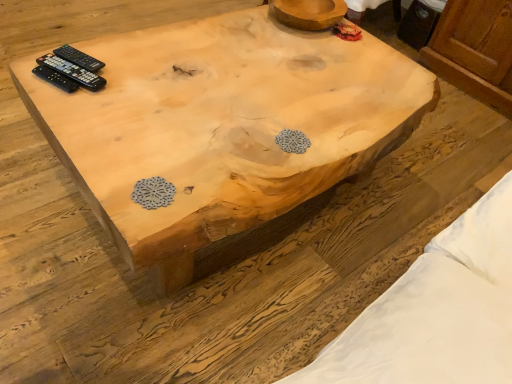
Question: Is black plastic remote at upper left, arranged as the first remote control when viewed from the front, facing away from black plastic remote control at upper left, the first remote control positioned from the back?

Choices:
 (A) yes
 (B) no

Answer: (B)

Question: From a real-world perspective, is black plastic remote at upper left, the 3th remote control when ordered from back to front, positioned over black plastic remote control at upper left, the first remote control positioned from the back, based on gravity?

Choices:
 (A) no
 (B) yes

Answer: (B)

Question: From a real-world perspective, is black plastic remote at upper left, the 3th remote control when ordered from back to front, below black plastic remote control at upper left, the first remote control positioned from the back?

Choices:
 (A) no
 (B) yes

Answer: (A)

Question: Can you confirm if black plastic remote at upper left, the 3th remote control when ordered from back to front, is smaller than black plastic remote control at upper left, the first remote control positioned from the back?

Choices:
 (A) yes
 (B) no

Answer: (B)

Question: Is black plastic remote at upper left, arranged as the first remote control when viewed from the front, in contact with black plastic remote control at upper left, the first remote control positioned from the back?

Choices:
 (A) yes
 (B) no

Answer: (A)

Question: From a real-world perspective, is natural wood coffee table at center positioned above or below black plastic remote control at upper left, arranged as the 3th remote control when viewed from the front?

Choices:
 (A) below
 (B) above

Answer: (A)

Question: Is natural wood coffee table at center inside the boundaries of black plastic remote control at upper left, arranged as the 3th remote control when viewed from the front, or outside?

Choices:
 (A) outside
 (B) inside

Answer: (A)

Question: Relative to black plastic remote control at upper left, the first remote control positioned from the back, is natural wood coffee table at center in front or behind?

Choices:
 (A) behind
 (B) front

Answer: (B)

Question: From the image's perspective, is natural wood coffee table at center above or below black plastic remote control at upper left, the first remote control positioned from the back?

Choices:
 (A) below
 (B) above

Answer: (A)

Question: Is black plastic remote control at upper left, arranged as the 3th remote control when viewed from the front, inside or outside of natural wood coffee table at center?

Choices:
 (A) outside
 (B) inside

Answer: (A)

Question: In the image, is black plastic remote control at upper left, arranged as the 3th remote control when viewed from the front, positioned in front of or behind natural wood coffee table at center?

Choices:
 (A) behind
 (B) front

Answer: (A)

Question: From a real-world perspective, is black plastic remote control at upper left, the first remote control positioned from the back, physically located above or below natural wood coffee table at center?

Choices:
 (A) above
 (B) below

Answer: (A)

Question: From their relative heights in the image, would you say black plastic remote control at upper left, arranged as the 3th remote control when viewed from the front, is taller or shorter than natural wood coffee table at center?

Choices:
 (A) tall
 (B) short

Answer: (B)

Question: Is black plastic remote controls at upper left, the second remote control from the back, situated inside natural wood coffee table at center or outside?

Choices:
 (A) inside
 (B) outside

Answer: (B)

Question: In terms of height, does black plastic remote controls at upper left, the second remote control from the back, look taller or shorter compared to natural wood coffee table at center?

Choices:
 (A) tall
 (B) short

Answer: (B)